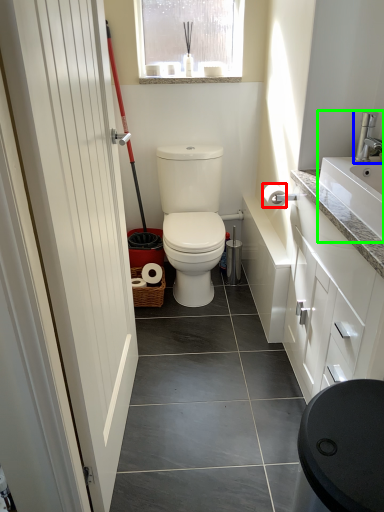
Question: Based on their relative distances, which object is farther from toilet paper (highlighted by a red box)? Choose from tap (highlighted by a blue box) and sink (highlighted by a green box).

Choices:
 (A) tap
 (B) sink

Answer: (B)